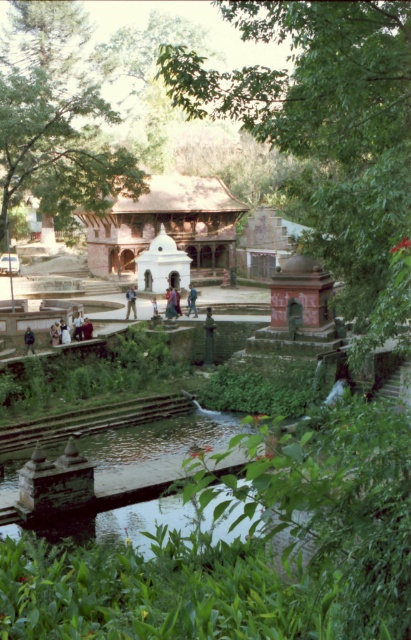
Question: Which point appears closest to the camera in this image?

Choices:
 (A) (127, 291)
 (B) (30, 349)
 (C) (73, 339)
 (D) (180, 284)

Answer: (B)

Question: Based on their relative distances, which object is farther from the blue denim jeans at center?

Choices:
 (A) light blue jeans at center
 (B) green stone pond at center
 (C) light brown wooden person at center
 (D) white stone gazebo at center

Answer: (B)

Question: Can you confirm if brown wooden gazebo at center is smaller than white stone gazebo at center?

Choices:
 (A) yes
 (B) no

Answer: (B)

Question: Considering the real-world distances, which object is farthest from the light brown wooden person at center?

Choices:
 (A) dark blue fabric person at lower left
 (B) dark blue jeans at lower left

Answer: (A)

Question: Does green stone pond at center have a smaller size compared to white stone gazebo at center?

Choices:
 (A) yes
 (B) no

Answer: (B)

Question: Is blue fabric person at center positioned in front of dark blue fabric person at lower left?

Choices:
 (A) yes
 (B) no

Answer: (B)